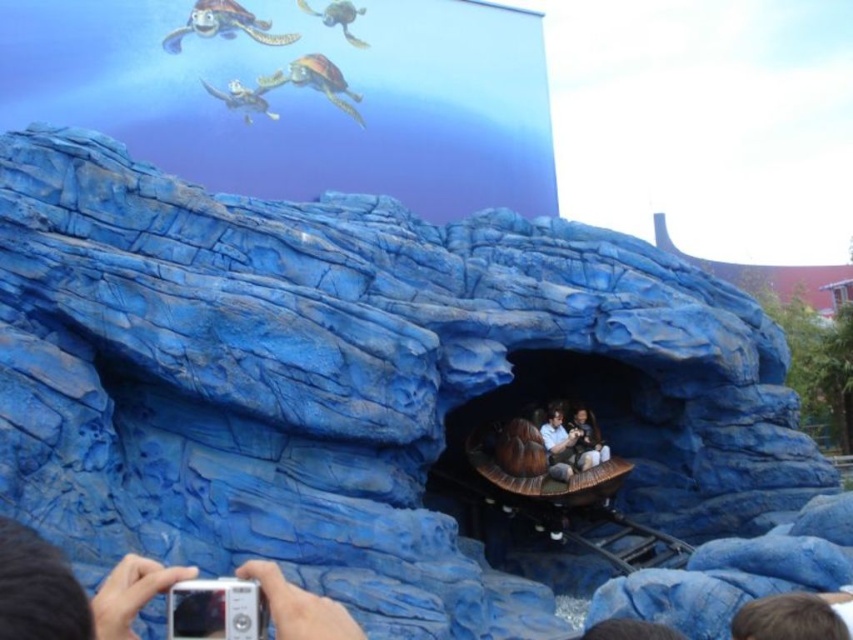
Question: Which point is closer to the camera?

Choices:
 (A) (44, 586)
 (B) (590, 451)

Answer: (A)

Question: Can you confirm if smooth brown leather jacket at center is positioned above smooth brown wooden boat at center?

Choices:
 (A) yes
 (B) no

Answer: (B)

Question: Is silver metallic camera at lower left positioned before smooth brown leather jacket at center?

Choices:
 (A) yes
 (B) no

Answer: (A)

Question: Which of these objects is positioned closest to the silver metallic camera at lower left?

Choices:
 (A) smooth brown leather jacket at center
 (B) smooth brown wooden boat at center

Answer: (A)

Question: Is silver metallic camera at lower left bigger than smooth brown leather jacket at center?

Choices:
 (A) no
 (B) yes

Answer: (B)

Question: Which of the following is the farthest from the observer?

Choices:
 (A) (584, 456)
 (B) (577, 435)

Answer: (B)